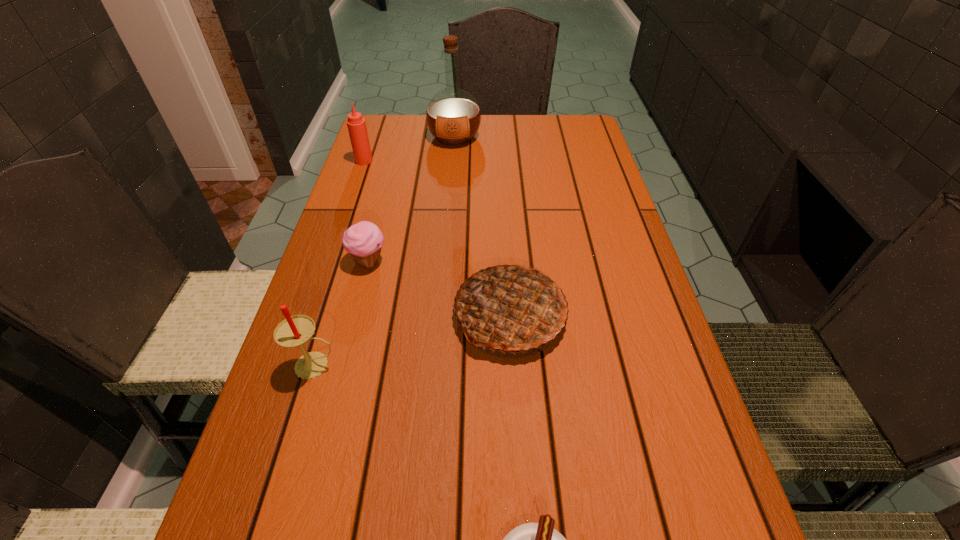
The height and width of the screenshot is (540, 960). In order to click on empty space that is in between the pie and the candle in this screenshot , I will do [413, 340].

I want to click on free space between the second shortest object and the liquor, so click(412, 199).

This screenshot has height=540, width=960. What are the coordinates of `free space between the liquor and the pie` in the screenshot? It's located at (482, 226).

Image resolution: width=960 pixels, height=540 pixels. I want to click on empty space that is in between the third farthest object and the pie, so click(439, 288).

Locate an element on the screen. vacant space that is in between the Tabasco sauce and the fourth nearest object is located at coordinates (366, 211).

Identify the location of free space that is in between the pie and the liquor. This screenshot has width=960, height=540. (482, 226).

Where is `vacant space in between the pie and the candle`? This screenshot has height=540, width=960. vacant space in between the pie and the candle is located at coordinates (413, 340).

At what (x,y) coordinates should I click in order to perform the action: click on vacant area that lies between the Tabasco sauce and the cupcake. Please return your answer as a coordinate pair (x, y). Looking at the image, I should click on (366, 211).

Identify the location of empty space between the third farthest object and the farthest object. (412, 199).

Image resolution: width=960 pixels, height=540 pixels. Find the location of `vacant area between the second farthest object and the candle`. vacant area between the second farthest object and the candle is located at coordinates [x=340, y=263].